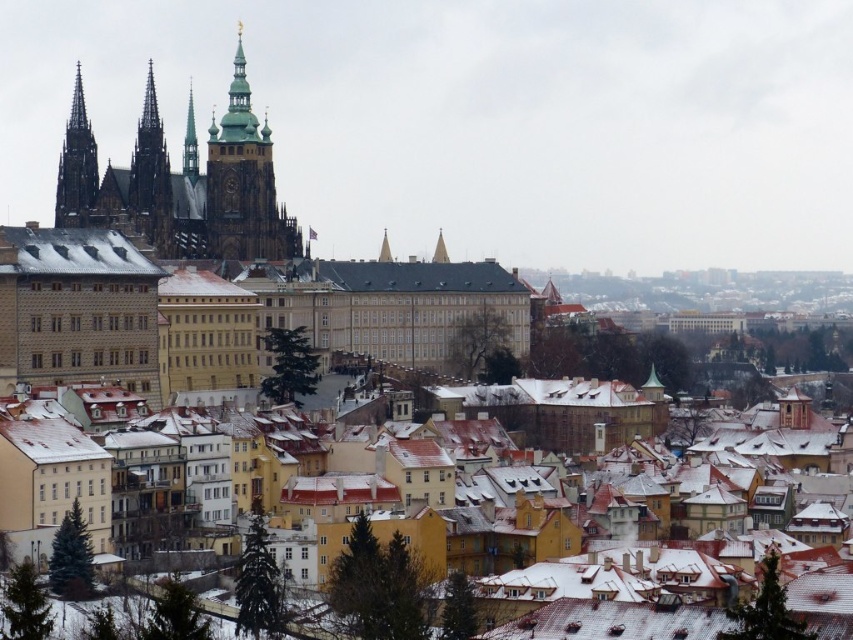
Does green stone tower at center have a larger size compared to smooth stone spire at center-left?

Indeed, green stone tower at center has a larger size compared to smooth stone spire at center-left.

Which is in front, point (242, 88) or point (143, 116)?

Point (242, 88) is in front.

Find the location of `green stone tower at center`. green stone tower at center is located at coordinates (244, 182).

Describe the element at coordinates (76, 164) in the screenshot. This screenshot has height=640, width=853. I see `dark gray stone spire at upper left` at that location.

Does dark gray stone spire at upper left have a larger size compared to green glass spire at center?

Yes, dark gray stone spire at upper left is bigger than green glass spire at center.

Is point (65, 205) positioned in front of point (192, 164)?

That is True.

You are a GUI agent. You are given a task and a screenshot of the screen. Output one action in this format:
    pyautogui.click(x=<x>, y=<y>)
    Task: Click on the dark gray stone spire at upper left
    This screenshot has height=640, width=853.
    Given the screenshot: What is the action you would take?
    pyautogui.click(x=76, y=164)

Between smooth stone spire at center-left and dark gray stone spire at upper left, which one has less height?

With less height is dark gray stone spire at upper left.

Is smooth stone spire at center-left to the left of dark gray stone spire at upper left from the viewer's perspective?

No, smooth stone spire at center-left is not to the left of dark gray stone spire at upper left.

Is point (131, 161) positioned after point (76, 145)?

No.

Where is `smooth stone spire at center-left`? This screenshot has height=640, width=853. smooth stone spire at center-left is located at coordinates (151, 177).